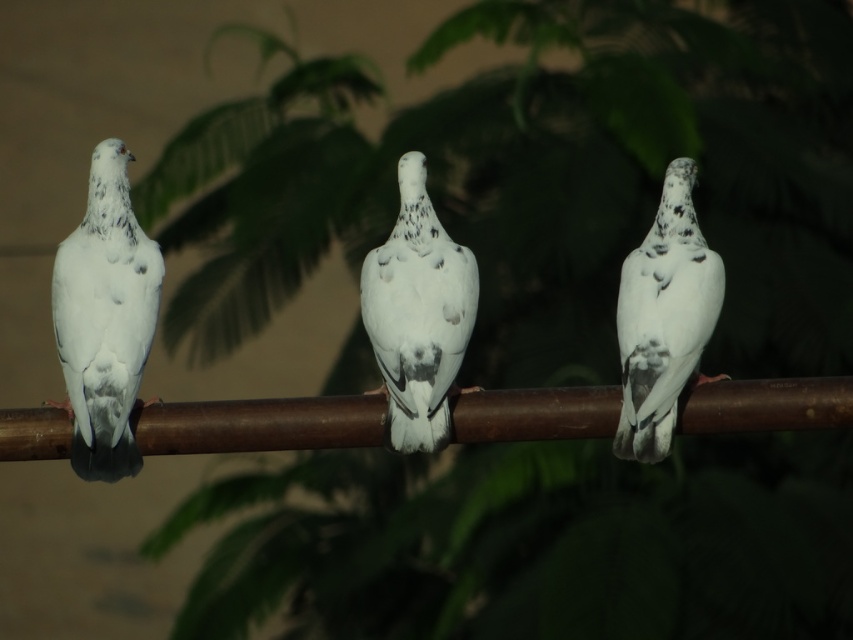
You are a photographer aiming to capture a photo of the speckled white bird at center and the speckled white dove at right. Which bird is positioned higher in the frame?

The speckled white bird at center is positioned higher in the frame than the speckled white dove at right.

You are standing in a park and see two birds on a metal rod. The birds are labeled as the speckled white bird at center and the speckled white dove at right. Which bird is positioned closer to your left side?

The speckled white bird at center is positioned closer to your left side since it is to the left of the speckled white dove at right.